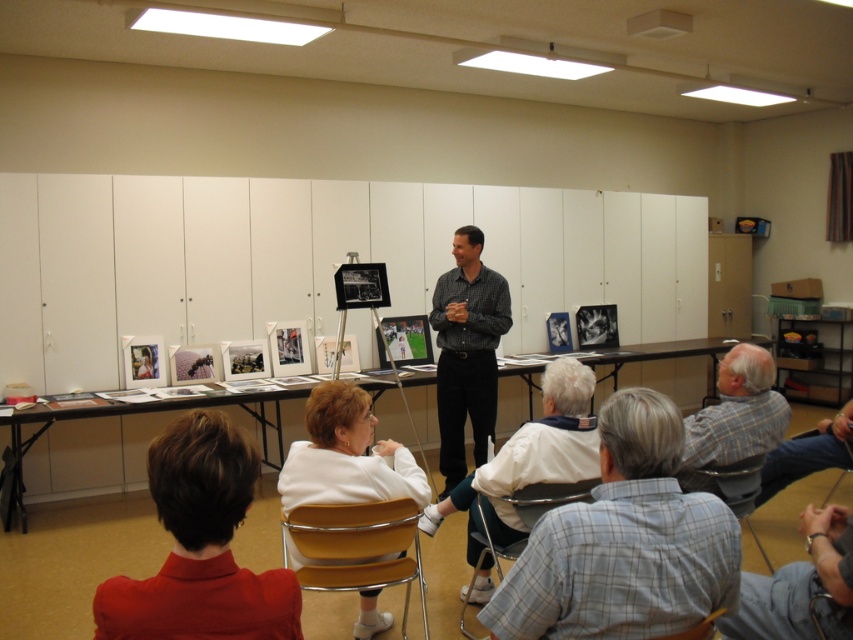
You are organizing a small event and need to know if the smooth red shirt at lower left can fit on a shelf designed for items narrower than the yellow plastic chair at lower center. Can it fit?

The smooth red shirt at lower left has a lesser width compared to the yellow plastic chair at lower center, so it can fit on the shelf designed for items narrower than the yellow plastic chair at lower center.

You are organizing a photo shoot and need to ensure that all objects in the scene are visible in the frame. Given that the checkered fabric shirt at center and the metallic silver chair at lower center are both in the shot, which object will appear bigger in the final photograph?

The checkered fabric shirt at center will appear bigger in the final photograph because it is larger in size than the metallic silver chair at lower center.

You are organizing a small event in this room and need to move the smooth red shirt at lower left and the yellow plastic chair at lower center to make space. Which object will require more effort to move due to its size?

The yellow plastic chair at lower center requires more effort to move because it occupies more space than the smooth red shirt at lower left according to the description.